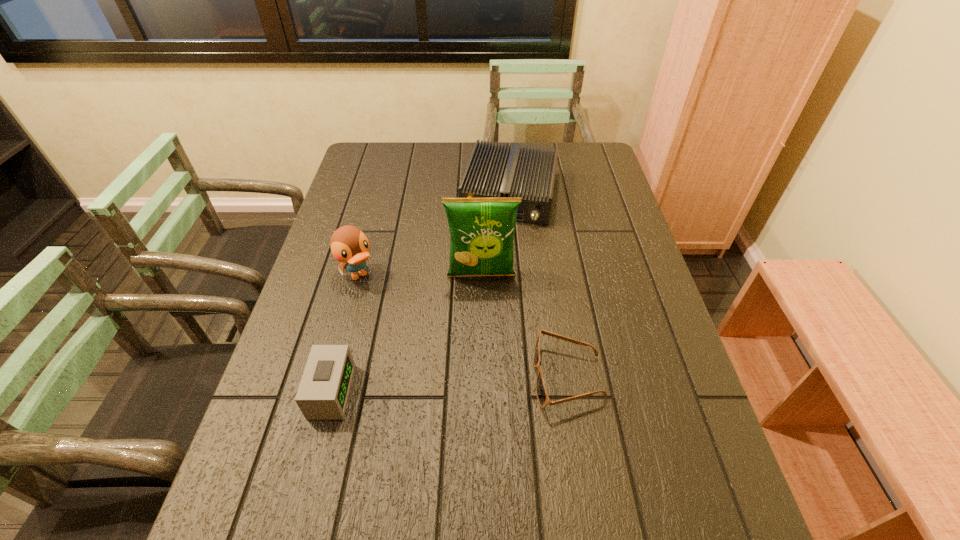
Where is `free spot on the desktop that is between the second shortest object and the sunglasses and is positioned on the back panel of the router`? free spot on the desktop that is between the second shortest object and the sunglasses and is positioned on the back panel of the router is located at coordinates pyautogui.click(x=465, y=383).

At what (x,y) coordinates should I click in order to perform the action: click on free space on the desktop that is between the alarm clock and the shortest object and is positioned on the front-facing side of the second tallest object. Please return your answer as a coordinate pair (x, y). Looking at the image, I should click on (446, 384).

What are the coordinates of `free space on the desktop that is between the alarm clock and the shortest object and is positioned on the front-facing side of the tallest object` in the screenshot? It's located at (484, 382).